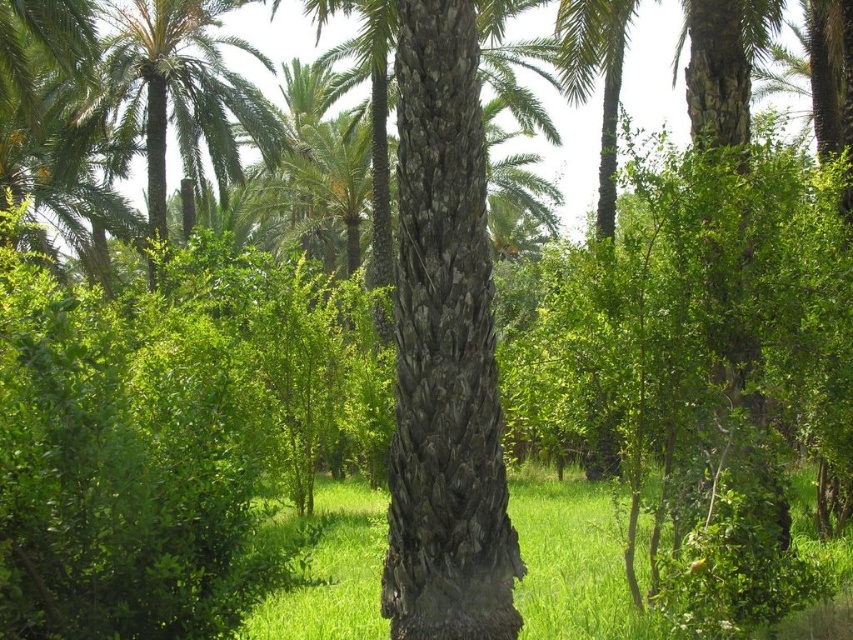
Question: Which point appears closest to the camera in this image?

Choices:
 (A) (201, 88)
 (B) (543, 579)

Answer: (B)

Question: Is green grass at center thinner than green textured palm tree at upper left?

Choices:
 (A) yes
 (B) no

Answer: (B)

Question: Can you confirm if green grass at center is positioned above green textured palm tree at upper left?

Choices:
 (A) no
 (B) yes

Answer: (A)

Question: Does green grass at center appear on the right side of green textured palm tree at upper left?

Choices:
 (A) no
 (B) yes

Answer: (B)